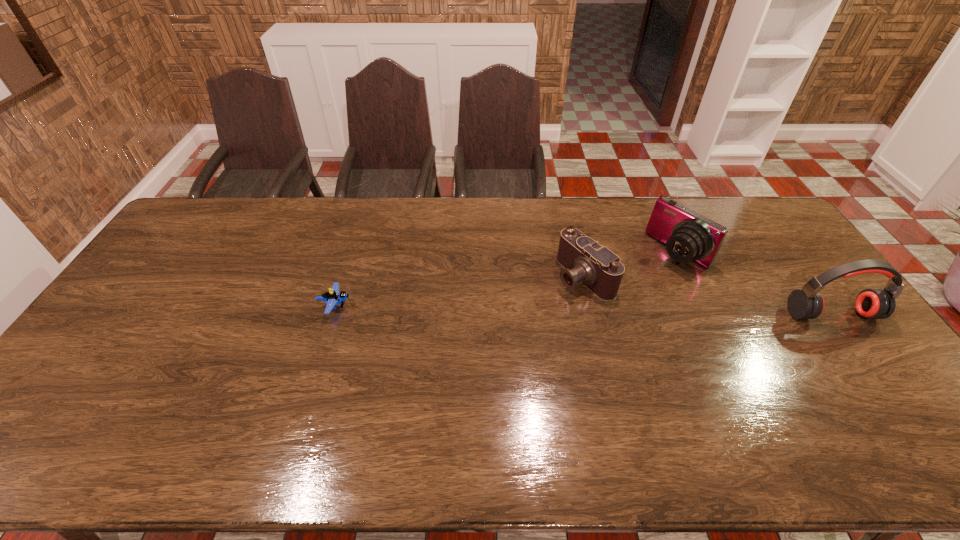
Identify the location of vacant area between the second object from right to left and the third tallest object. This screenshot has height=540, width=960. (631, 264).

The height and width of the screenshot is (540, 960). Identify the location of unoccupied position between the second object from right to left and the Lego. (507, 279).

Image resolution: width=960 pixels, height=540 pixels. What are the coordinates of `free space between the shorter camera and the earphone` in the screenshot? It's located at (708, 295).

You are a GUI agent. You are given a task and a screenshot of the screen. Output one action in this format:
    pyautogui.click(x=<x>, y=<y>)
    Task: Click on the object that is the third closest to the taller camera
    
    Given the screenshot: What is the action you would take?
    pyautogui.click(x=332, y=298)

At what (x,y) coordinates should I click in order to perform the action: click on object that stands as the third closest to the rightmost object. Please return your answer as a coordinate pair (x, y). The width and height of the screenshot is (960, 540). Looking at the image, I should click on (332, 298).